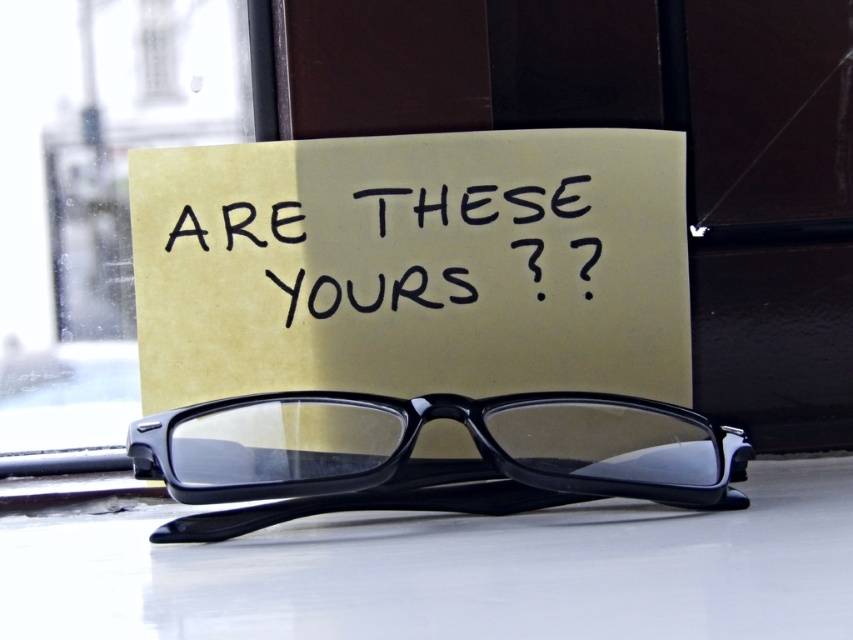
Question: Is yellow paper at center behind transparent glass window at upper left?

Choices:
 (A) no
 (B) yes

Answer: (A)

Question: Can you confirm if transparent glass window at upper left is positioned to the right of black handwritten text at center?

Choices:
 (A) no
 (B) yes

Answer: (A)

Question: Which point is closer to the camera?

Choices:
 (A) transparent glass window at upper left
 (B) black plastic glasses at center
 (C) yellow paper at center

Answer: (B)

Question: Based on their relative distances, which object is nearer to the black handwritten text at center?

Choices:
 (A) transparent glass window at upper left
 (B) yellow paper at center
 (C) black plastic glasses at center

Answer: (B)

Question: Which point is closer to the camera?

Choices:
 (A) (451, 285)
 (B) (496, 506)
 (C) (192, 80)

Answer: (B)

Question: Does black plastic glasses at center have a smaller size compared to black handwritten text at center?

Choices:
 (A) no
 (B) yes

Answer: (A)